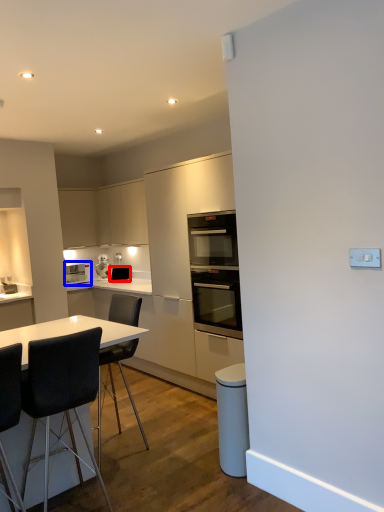
Question: Among these objects, which one is farthest to the camera, appliance (highlighted by a red box) or home appliance (highlighted by a blue box)?

Choices:
 (A) appliance
 (B) home appliance

Answer: (A)